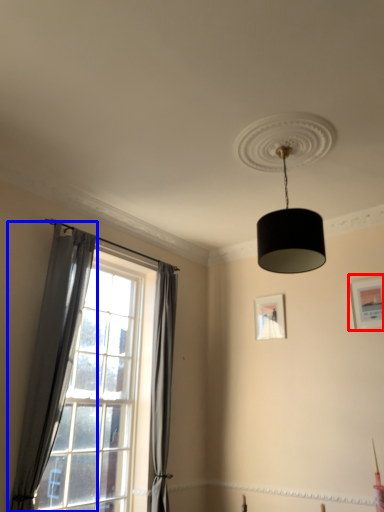
Question: Which point is closer to the camera, picture frame (highlighted by a red box) or curtain (highlighted by a blue box)?

Choices:
 (A) picture frame
 (B) curtain

Answer: (B)